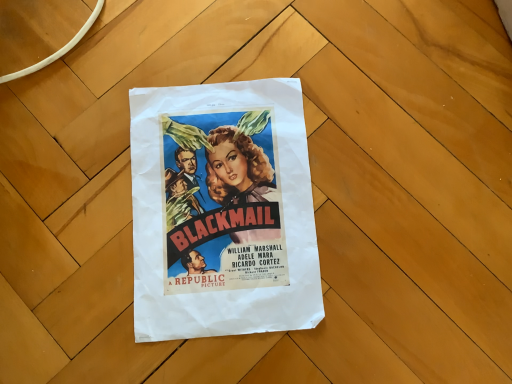
What do you see at coordinates (222, 211) in the screenshot?
I see `matte paper poster at center` at bounding box center [222, 211].

This screenshot has height=384, width=512. I want to click on matte paper poster at center, so click(x=222, y=211).

Where is `matte paper poster at center`? The width and height of the screenshot is (512, 384). matte paper poster at center is located at coordinates (222, 211).